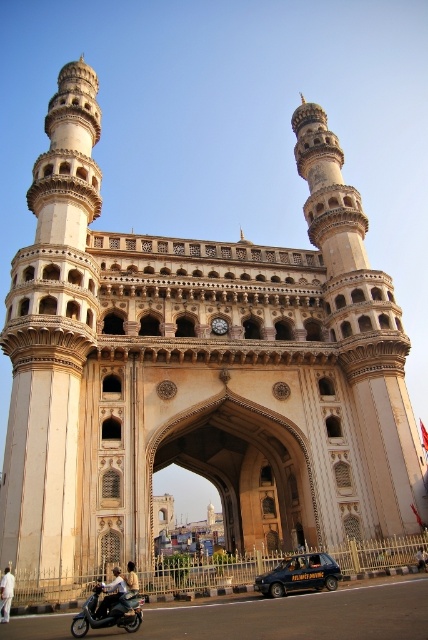
Question: Among these points, which one is farthest from the camera?

Choices:
 (A) (133, 579)
 (B) (8, 573)
 (C) (89, 624)

Answer: (A)

Question: From the image, what is the correct spatial relationship of black matte taxi at center in relation to white cotton shirt at center?

Choices:
 (A) above
 (B) below

Answer: (B)

Question: Which object is positioned farthest from the white cotton shirt at center?

Choices:
 (A) metallic silver scooter at lower left
 (B) black matte taxi at center

Answer: (B)

Question: Which is nearer to the light blue fabric shirt at center?

Choices:
 (A) black matte taxi at center
 (B) metallic silver scooter at lower left

Answer: (B)

Question: Can you confirm if white cotton shirt at center is positioned above light brown leather jacket at center?

Choices:
 (A) no
 (B) yes

Answer: (B)

Question: Can you confirm if black matte taxi at center is smaller than white cotton shirt at center?

Choices:
 (A) no
 (B) yes

Answer: (A)